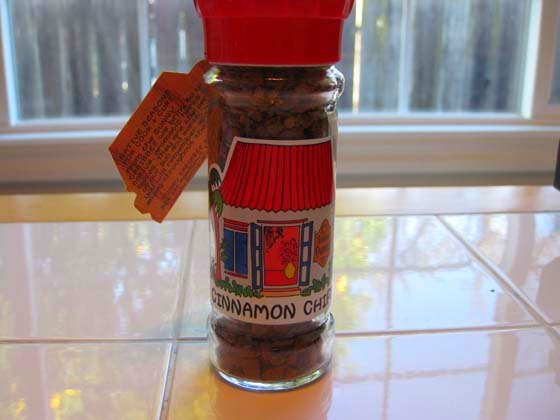
Where is `window`? window is located at coordinates (237, 255).